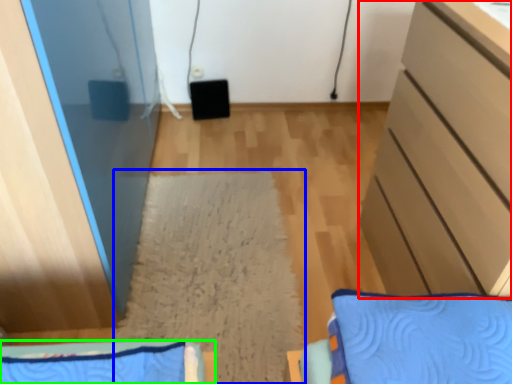
Question: Which object is positioned farthest from cabinetry (highlighted by a red box)? Select from mat (highlighted by a blue box) and furniture (highlighted by a green box).

Choices:
 (A) mat
 (B) furniture

Answer: (B)